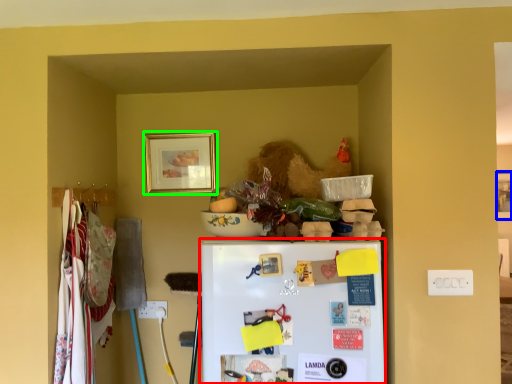
Question: Which is nearer to the refrigerator (highlighted by a red box)? picture frame (highlighted by a blue box) or picture frame (highlighted by a green box).

Choices:
 (A) picture frame
 (B) picture frame

Answer: (B)